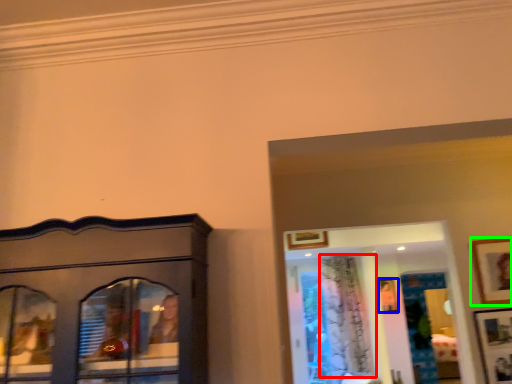
Question: Considering the real-world distances, which object is farthest from curtain (highlighted by a red box)? picture frame (highlighted by a blue box) or picture frame (highlighted by a green box)?

Choices:
 (A) picture frame
 (B) picture frame

Answer: (B)